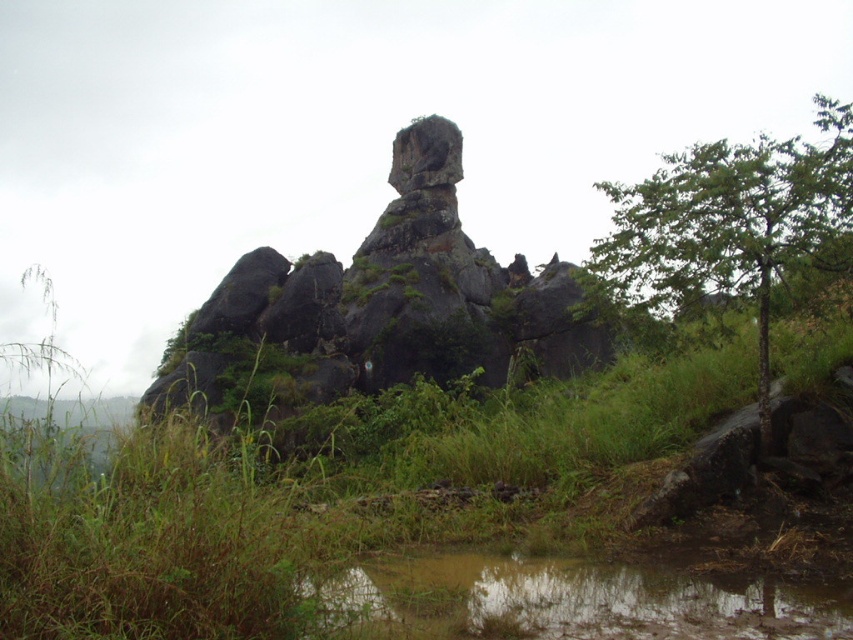
Question: Can you confirm if green grassy at center is bigger than green leafy tree at right?

Choices:
 (A) yes
 (B) no

Answer: (B)

Question: Which object appears farthest from the camera in this image?

Choices:
 (A) green leafy tree at right
 (B) rough granite rock at center
 (C) green grassy at center
 (D) muddy water at lower center

Answer: (B)

Question: Based on their relative distances, which object is nearer to the muddy water at lower center?

Choices:
 (A) green grassy at center
 (B) green leafy tree at right
 (C) rough granite rock at center

Answer: (A)

Question: Observing the image, what is the correct spatial positioning of green grassy at center in reference to rough granite rock at center?

Choices:
 (A) below
 (B) above

Answer: (A)

Question: Is rough granite rock at center to the left of green leafy tree at right from the viewer's perspective?

Choices:
 (A) no
 (B) yes

Answer: (B)

Question: Based on their relative distances, which object is farther from the green grassy at center?

Choices:
 (A) muddy water at lower center
 (B) green leafy tree at right

Answer: (B)